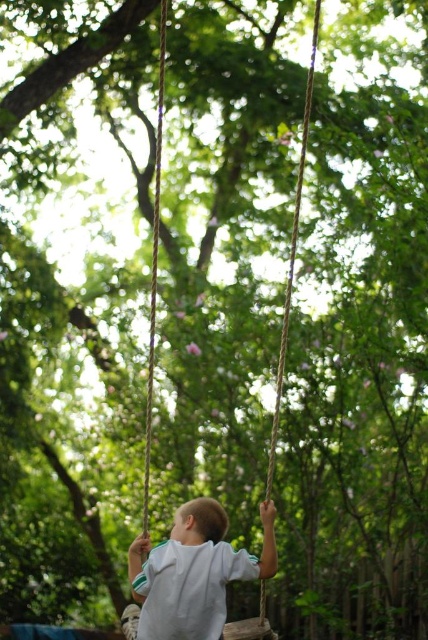
Question: Is white cotton shirt at center positioned in front of rope swing at center?

Choices:
 (A) yes
 (B) no

Answer: (A)

Question: Which point is farther to the camera?

Choices:
 (A) (149, 433)
 (B) (219, 532)

Answer: (B)

Question: Observing the image, what is the correct spatial positioning of white cotton shirt at center in reference to rope swing at center?

Choices:
 (A) left
 (B) right

Answer: (B)

Question: Does white cotton shirt at center have a larger size compared to rope swing at center?

Choices:
 (A) no
 (B) yes

Answer: (B)